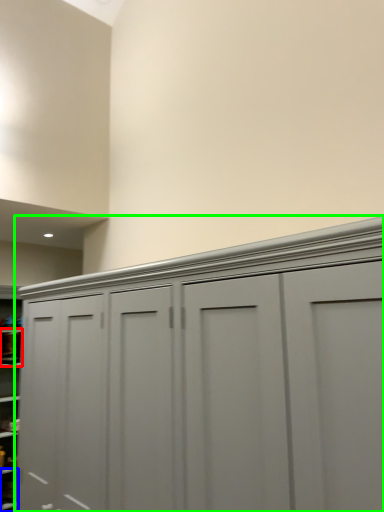
Question: Based on their relative distances, which object is farther from cabinet (highlighted by a red box)? Choose from cabinet (highlighted by a blue box) and cupboard (highlighted by a green box).

Choices:
 (A) cabinet
 (B) cupboard

Answer: (B)